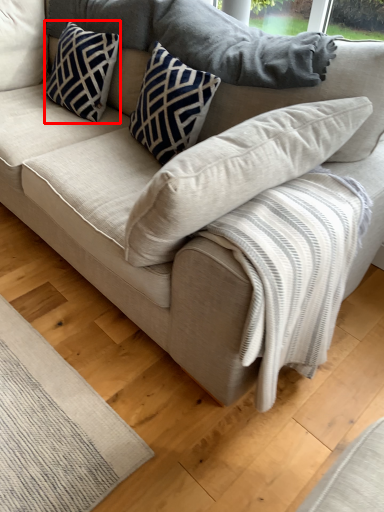
Question: From the image's perspective, where is pillow (annotated by the red box) located relative to pillow?

Choices:
 (A) above
 (B) below

Answer: (A)